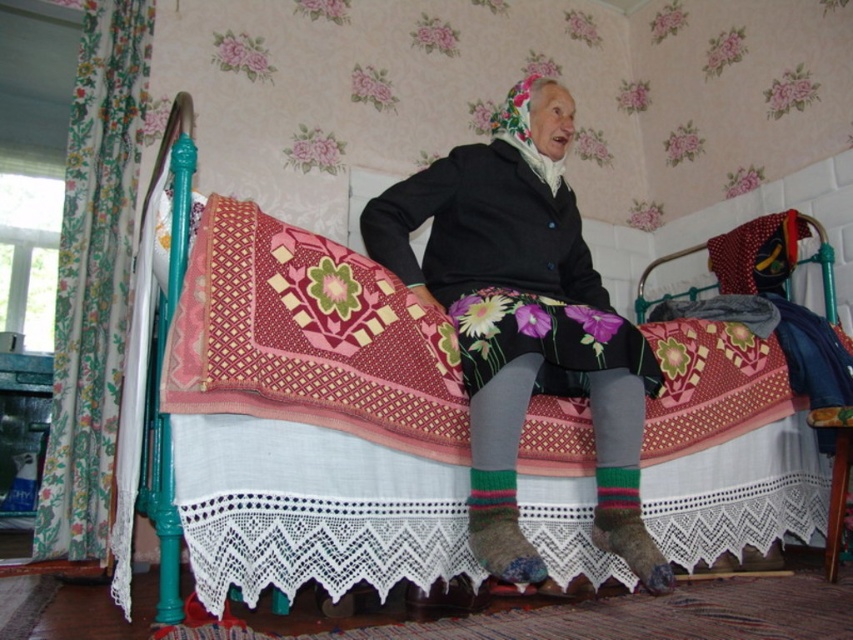
Question: Which of the following is the closest to the observer?

Choices:
 (A) (231, 531)
 (B) (564, 284)

Answer: (A)

Question: Does pink fabric bed at center appear on the left side of floral-patterned fabric skirt at center?

Choices:
 (A) yes
 (B) no

Answer: (B)

Question: Which point appears farthest from the camera in this image?

Choices:
 (A) (585, 349)
 (B) (360, 436)

Answer: (A)

Question: Can you confirm if pink fabric bed at center is positioned above floral-patterned fabric skirt at center?

Choices:
 (A) yes
 (B) no

Answer: (B)

Question: Is pink fabric bed at center bigger than floral-patterned fabric skirt at center?

Choices:
 (A) yes
 (B) no

Answer: (A)